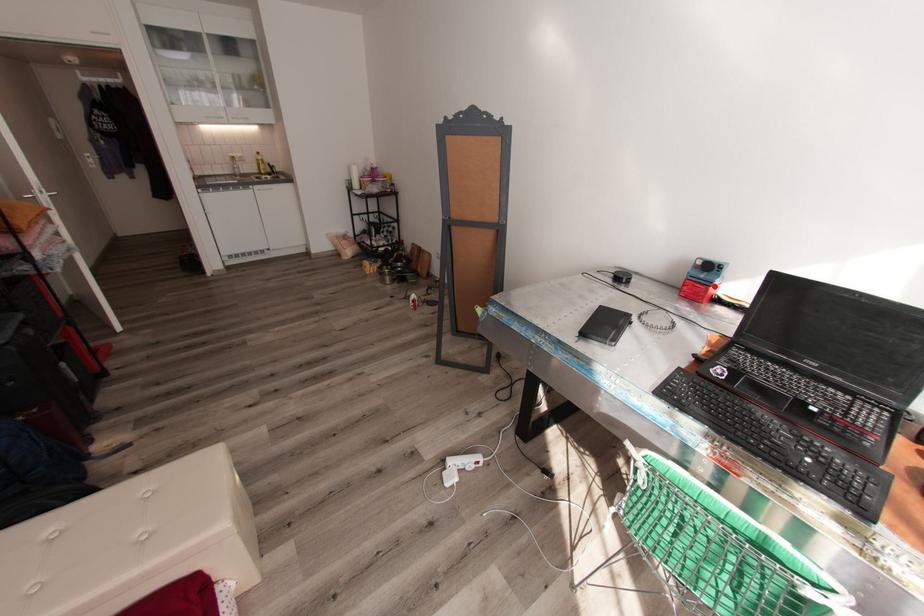
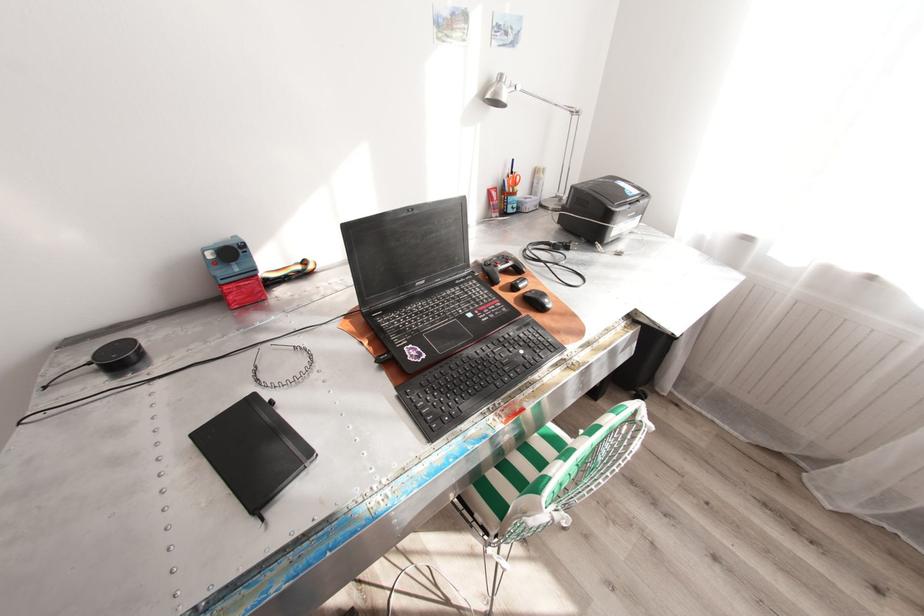
The point at the highlighted location is marked in the first image. Where is the corresponding point in the second image?

(261, 275)